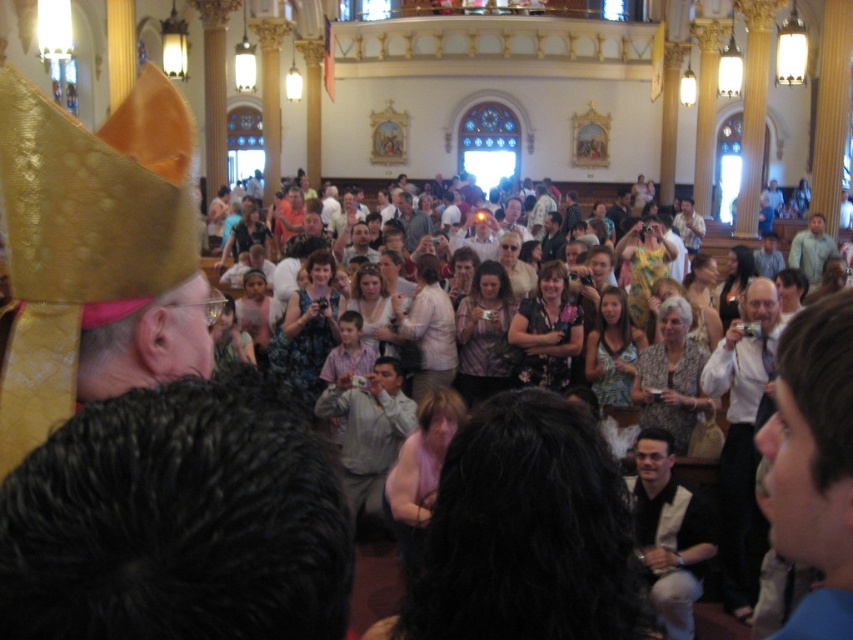
Question: Can you confirm if white shirt at center is wider than gray fabric shirt at center?

Choices:
 (A) no
 (B) yes

Answer: (A)

Question: Can you confirm if white textured vest at lower center is wider than light brown leather jacket at center?

Choices:
 (A) no
 (B) yes

Answer: (B)

Question: Is the position of white textured vest at lower center more distant than that of gray fabric shirt at center?

Choices:
 (A) yes
 (B) no

Answer: (A)

Question: Which point is farther to the camera?

Choices:
 (A) white shirt at center
 (B) light brown leather jacket at center
 (C) gray fabric shirt at center
 (D) blue shirt at lower right

Answer: (B)

Question: Which of the following is the closest to the observer?

Choices:
 (A) white textured vest at lower center
 (B) gray fabric shirt at center
 (C) blue shirt at lower right
 (D) white shirt at center

Answer: (C)

Question: Which point is farther to the camera?

Choices:
 (A) (810, 541)
 (B) (729, 604)

Answer: (B)